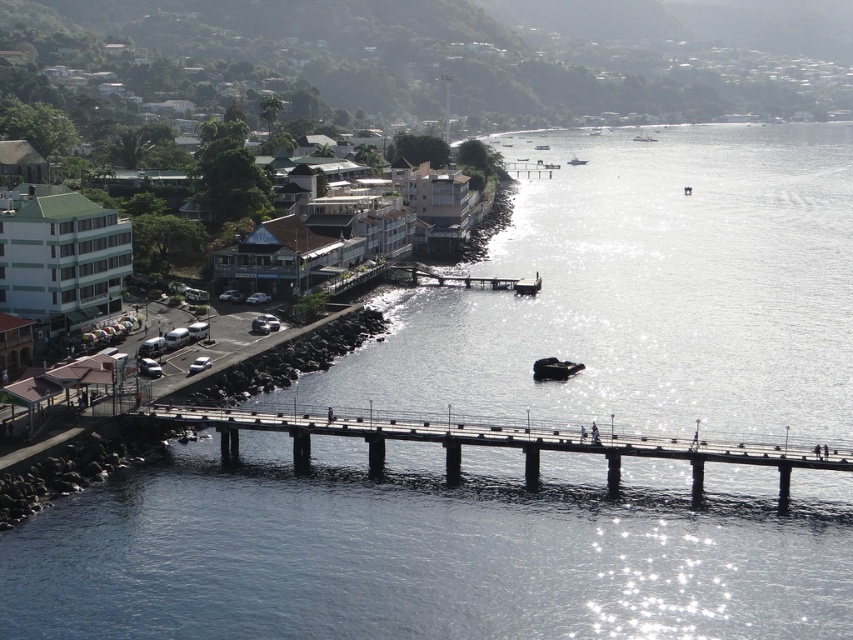
You are standing on the pier and see both the white plastic boat at center and the metallic gray boat at center. Which boat is closer to the water surface?

The white plastic boat at center is closer to the water surface because it is located below the metallic gray boat at center.

You are standing on the pier and want to take a photo of both the smooth concrete bridge at center and the white plastic boat at center. Which object should you position to your left side in the frame to include both in the photo?

You should position the smooth concrete bridge at center to your left side in the frame because it is already to the left of the white plastic boat at center according to the description.